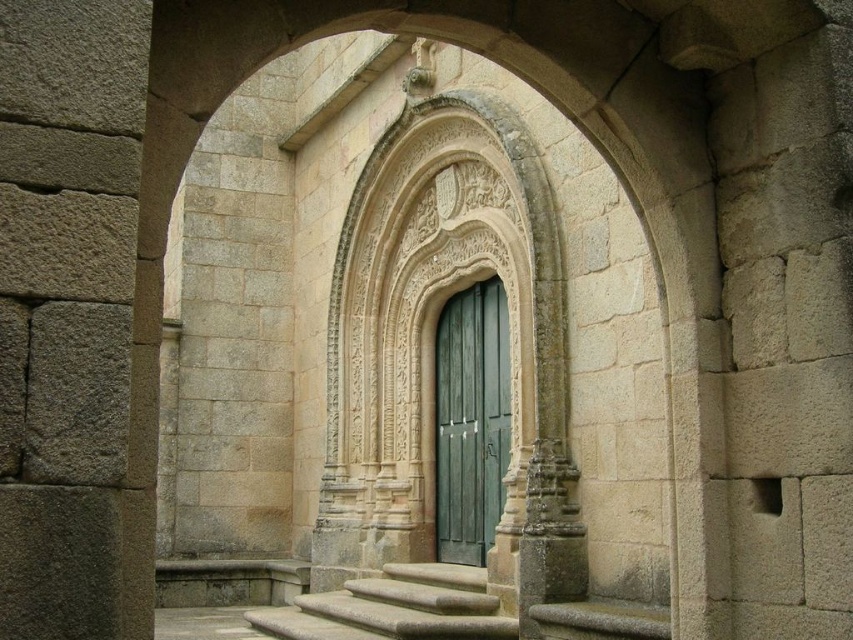
You are a painter who wants to paint both the green wooden door at center and the smooth gray stone stairs at center. Which object requires a larger canvas in terms of width?

The smooth gray stone stairs at center requires a larger canvas because its width is greater than the green wooden door at center.

You are standing in front of the stone archway. To locate the green wooden door at center, where should you look relative to the archway?

The green wooden door at center is located at the center of the archway, so you should look straight ahead towards the middle of the archway to find it.